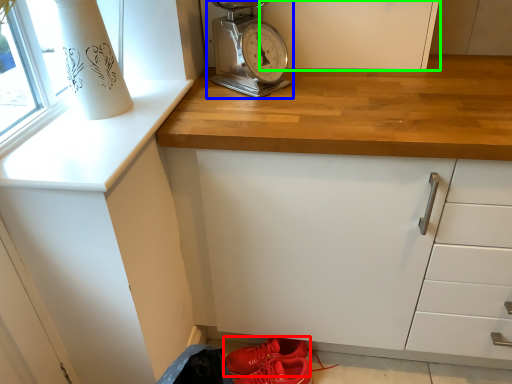
Question: Considering the real-world distances, which object is closest to footwear (highlighted by a red box)? home appliance (highlighted by a blue box) or cabinetry (highlighted by a green box).

Choices:
 (A) home appliance
 (B) cabinetry

Answer: (A)